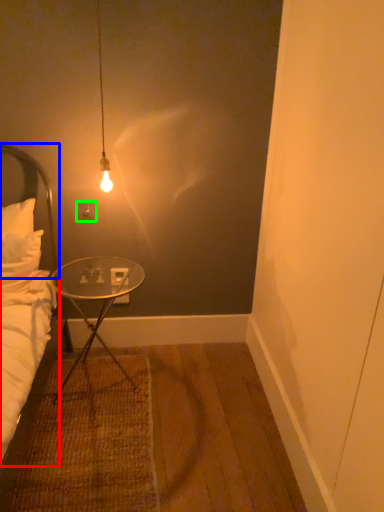
Question: Estimate the real-world distances between objects in this image. Which object is closer to bed (highlighted by a red box), headboard (highlighted by a blue box) or power outlet (highlighted by a green box)?

Choices:
 (A) headboard
 (B) power outlet

Answer: (A)